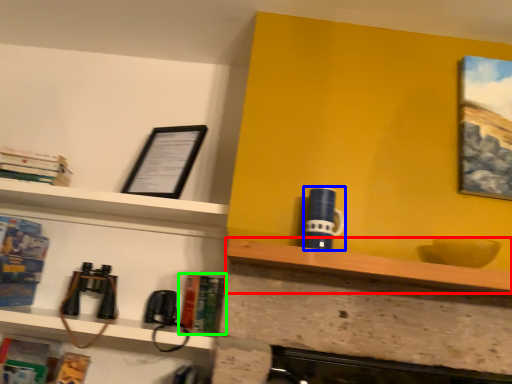
Question: Estimate the real-world distances between objects in this image. Which object is closer to shelf (highlighted by a red box), mug (highlighted by a blue box) or book (highlighted by a green box)?

Choices:
 (A) mug
 (B) book

Answer: (A)